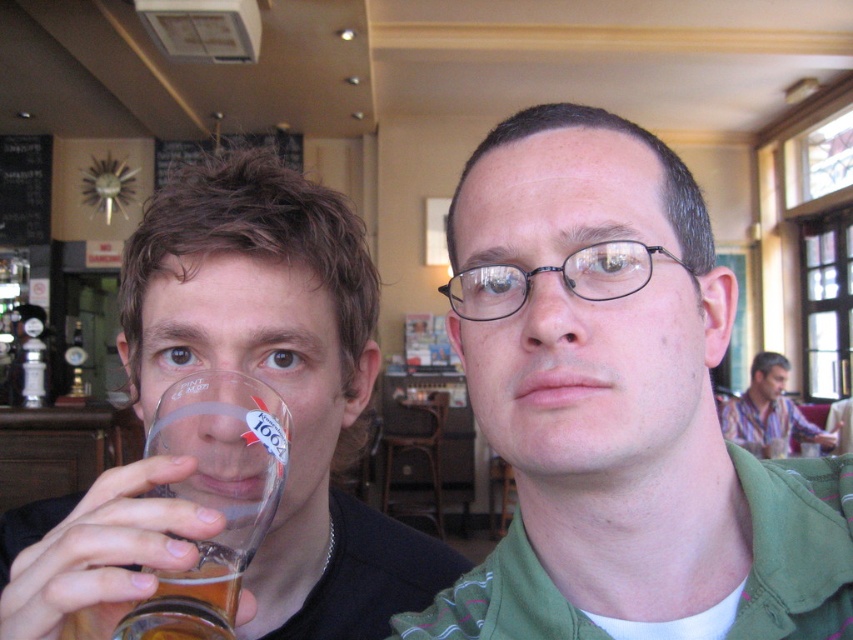
Question: From the image, what is the correct spatial relationship of green fabric shirt at center in relation to translucent glass beer at lower left?

Choices:
 (A) left
 (B) right

Answer: (B)

Question: Considering the real-world distances, which object is farthest from the green fabric shirt at center?

Choices:
 (A) clear glass beer at left
 (B) striped cotton shirt at right
 (C) clear glass beer glass at left

Answer: (B)

Question: Among these points, which one is farthest from the camera?

Choices:
 (A) (757, 381)
 (B) (183, 625)

Answer: (A)

Question: Can you confirm if green fabric shirt at center is smaller than translucent glass beer at lower left?

Choices:
 (A) no
 (B) yes

Answer: (A)

Question: Considering the real-world distances, which object is farthest from the clear glass beer at left?

Choices:
 (A) translucent glass beer at lower left
 (B) striped cotton shirt at right

Answer: (B)

Question: Does translucent glass beer at lower left have a greater width compared to striped cotton shirt at right?

Choices:
 (A) yes
 (B) no

Answer: (B)